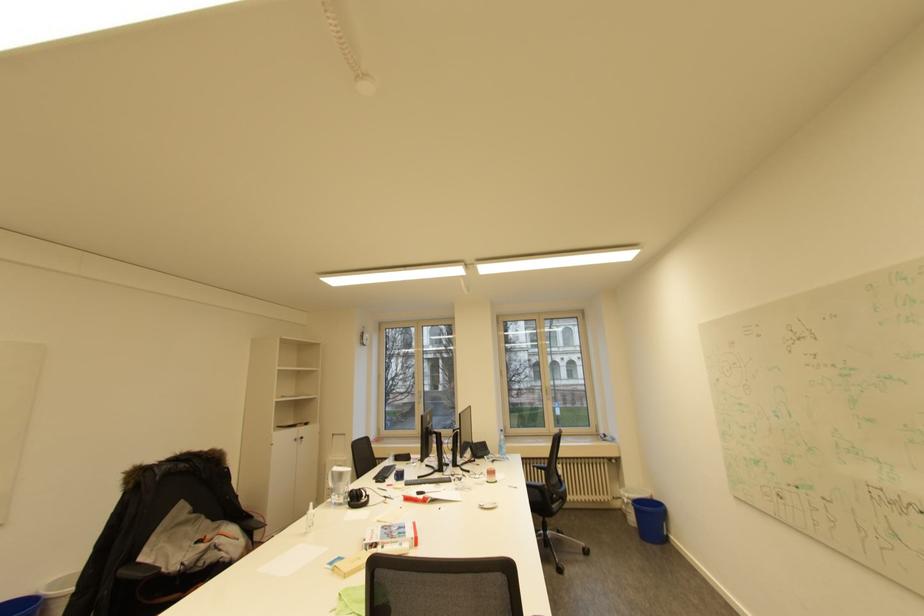
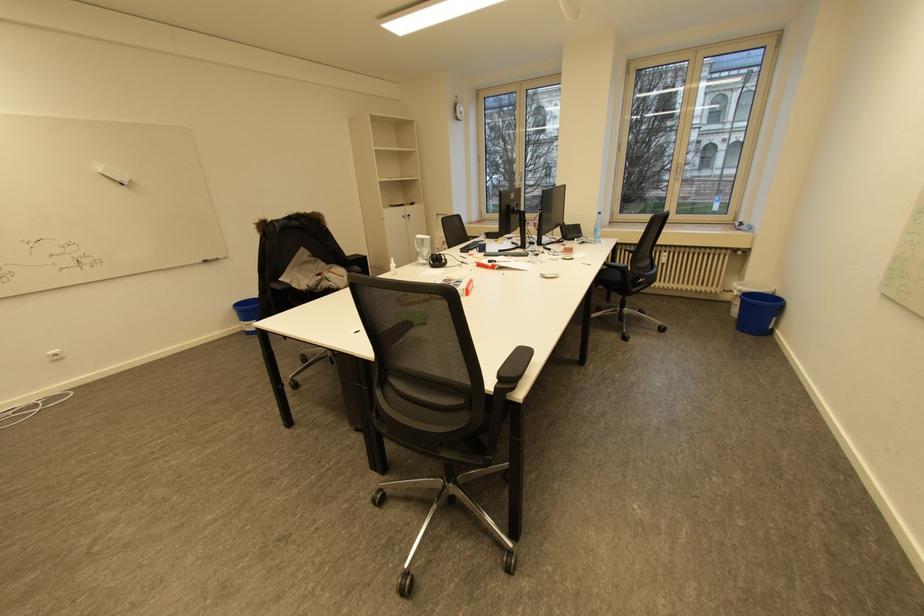
Find the pixel in the second image that matches point 347,474 in the first image.

(428, 240)